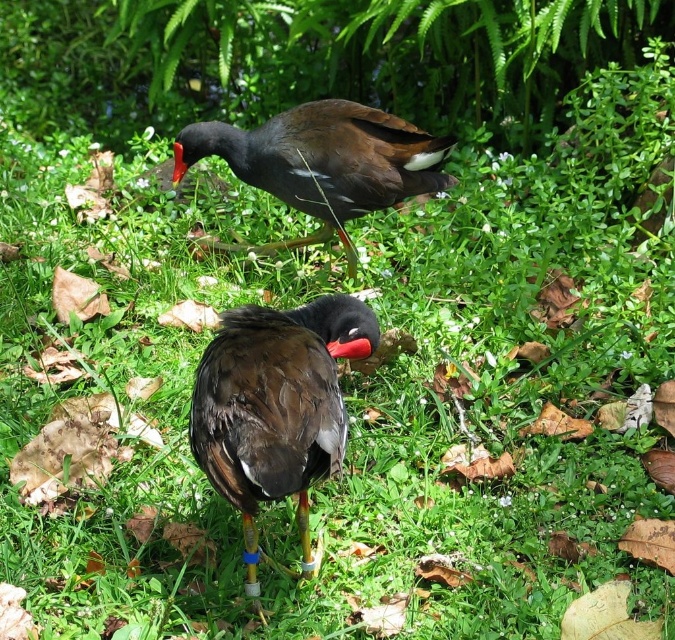
Question: Which object is farther from the camera taking this photo?

Choices:
 (A) shiny brown bird at upper center
 (B) red matte beak at center
 (C) dark brown feathers at center

Answer: (B)

Question: Does dark brown feathers at center appear under red matte beak at center?

Choices:
 (A) no
 (B) yes

Answer: (B)

Question: Which object appears farthest from the camera in this image?

Choices:
 (A) dark brown feathers at center
 (B) shiny brown bird at upper center
 (C) red matte beak at center

Answer: (C)

Question: Is shiny brown bird at upper center below red matte beak at center?

Choices:
 (A) no
 (B) yes

Answer: (B)

Question: Is dark brown feathers at center to the right of shiny brown bird at upper center from the viewer's perspective?

Choices:
 (A) no
 (B) yes

Answer: (B)

Question: Which point is closer to the camera?

Choices:
 (A) (178, 163)
 (B) (383, 141)
 (C) (294, 314)

Answer: (C)